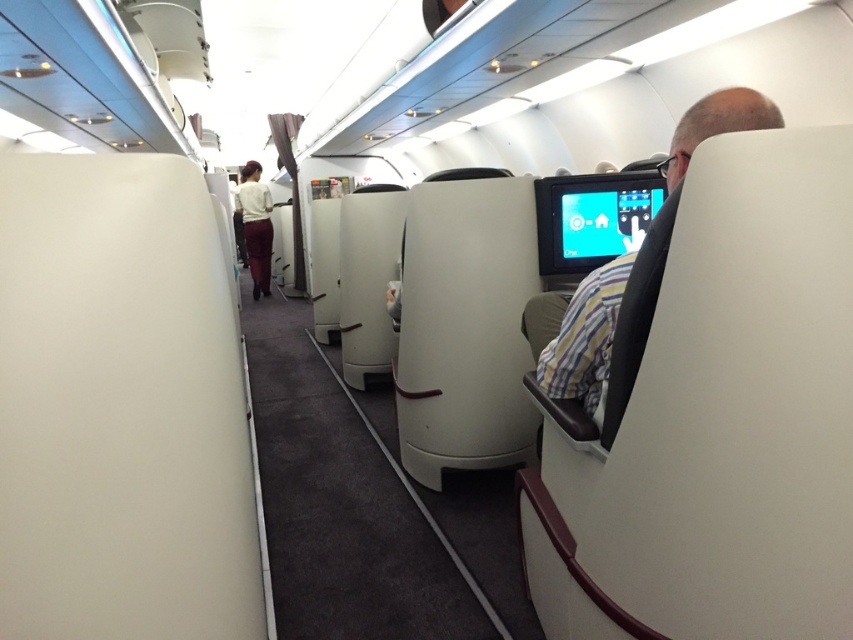
Question: Does striped fabric shirt at right have a greater width compared to white fabric uniform at center?

Choices:
 (A) no
 (B) yes

Answer: (A)

Question: Is striped fabric shirt at right wider than white fabric uniform at center?

Choices:
 (A) no
 (B) yes

Answer: (A)

Question: Does striped fabric shirt at right have a smaller size compared to white fabric uniform at center?

Choices:
 (A) yes
 (B) no

Answer: (A)